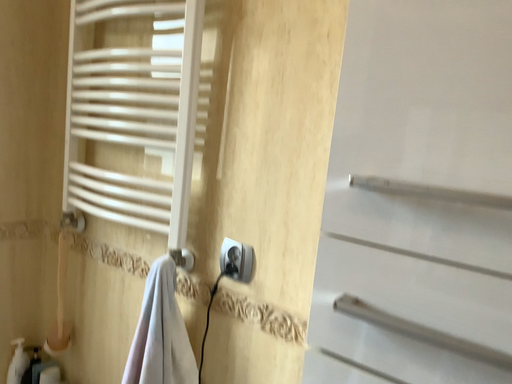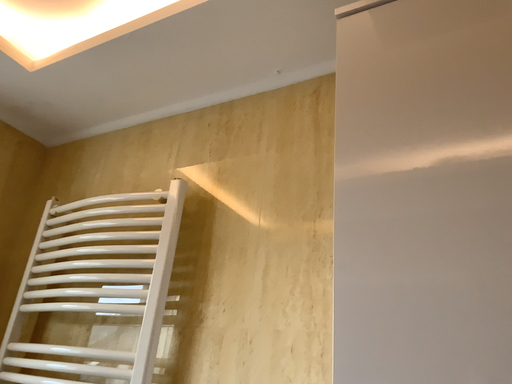
Question: How did the camera likely rotate when shooting the video?

Choices:
 (A) rotated downward
 (B) rotated upward

Answer: (B)